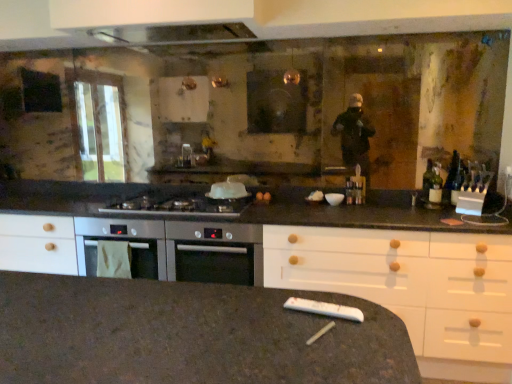
Image resolution: width=512 pixels, height=384 pixels. What do you see at coordinates (182, 206) in the screenshot? I see `satin silver cooktop at center` at bounding box center [182, 206].

This screenshot has height=384, width=512. What are the coordinates of `satin silver cooktop at center` in the screenshot? It's located at (182, 206).

I want to click on white plastic remote control at lower center, so click(x=324, y=309).

What is the approximate width of white plastic remote control at lower center?

2.12 inches.

The height and width of the screenshot is (384, 512). Describe the element at coordinates (324, 309) in the screenshot. I see `white plastic remote control at lower center` at that location.

Where is `satin silver cooktop at center`? This screenshot has height=384, width=512. satin silver cooktop at center is located at coordinates (182, 206).

Can you confirm if satin silver cooktop at center is positioned to the right of white plastic remote control at lower center?

In fact, satin silver cooktop at center is to the left of white plastic remote control at lower center.

Does satin silver cooktop at center come in front of white plastic remote control at lower center?

No, satin silver cooktop at center is further to the viewer.

Considering the points (186, 207) and (308, 301), which point is behind, point (186, 207) or point (308, 301)?

The point (186, 207) is farther.

From the image's perspective, is satin silver cooktop at center on white plastic remote control at lower center?

Indeed, from the image's perspective, satin silver cooktop at center is shown above white plastic remote control at lower center.

From a real-world perspective, between satin silver cooktop at center and white plastic remote control at lower center, who is vertically higher?

satin silver cooktop at center.

Which of these two, satin silver cooktop at center or white plastic remote control at lower center, is wider?

Wider between the two is satin silver cooktop at center.

Considering the sizes of objects satin silver cooktop at center and white plastic remote control at lower center in the image provided, who is taller, satin silver cooktop at center or white plastic remote control at lower center?

Standing taller between the two is satin silver cooktop at center.

Considering the sizes of objects satin silver cooktop at center and white plastic remote control at lower center in the image provided, who is smaller, satin silver cooktop at center or white plastic remote control at lower center?

Smaller between the two is white plastic remote control at lower center.

Looking at this image, would you say satin silver cooktop at center is outside white plastic remote control at lower center?

satin silver cooktop at center lies outside white plastic remote control at lower center's area.

Would you consider satin silver cooktop at center to be distant from white plastic remote control at lower center?

Indeed, satin silver cooktop at center is not near white plastic remote control at lower center.

Is satin silver cooktop at center oriented away from white plastic remote control at lower center?

satin silver cooktop at center does not have its back to white plastic remote control at lower center.

What's the angular difference between satin silver cooktop at center and white plastic remote control at lower center's facing directions?

There is a 11.6-degree angle between the facing directions of satin silver cooktop at center and white plastic remote control at lower center.

Where is `appliance that appears in front of the satin silver cooktop at center`? appliance that appears in front of the satin silver cooktop at center is located at coordinates (324, 309).

From the picture: Between white plastic remote control at lower center and satin silver cooktop at center, which one appears on the right side from the viewer's perspective?

From the viewer's perspective, white plastic remote control at lower center appears more on the right side.

Which is behind, white plastic remote control at lower center or satin silver cooktop at center?

Positioned behind is satin silver cooktop at center.

Considering the points (346, 311) and (206, 194), which point is in front, point (346, 311) or point (206, 194)?

Point (346, 311)

From the image's perspective, which one is positioned lower, white plastic remote control at lower center or satin silver cooktop at center?

white plastic remote control at lower center, from the image's perspective.

From a real-world perspective, who is located higher, white plastic remote control at lower center or satin silver cooktop at center?

satin silver cooktop at center, from a real-world perspective.

Looking at their sizes, would you say white plastic remote control at lower center is wider or thinner than satin silver cooktop at center?

white plastic remote control at lower center is thinner than satin silver cooktop at center.

Considering the sizes of objects white plastic remote control at lower center and satin silver cooktop at center in the image provided, who is taller, white plastic remote control at lower center or satin silver cooktop at center?

With more height is satin silver cooktop at center.

Based on their sizes in the image, would you say white plastic remote control at lower center is bigger or smaller than satin silver cooktop at center?

In the image, white plastic remote control at lower center appears to be smaller than satin silver cooktop at center.

Choose the correct answer: Is white plastic remote control at lower center inside satin silver cooktop at center or outside it?

The correct answer is: outside.

Does white plastic remote control at lower center touch satin silver cooktop at center?

No, white plastic remote control at lower center is not next to satin silver cooktop at center.

Is satin silver cooktop at center at the back of white plastic remote control at lower center?

white plastic remote control at lower center does not have its back to satin silver cooktop at center.

Can you tell me how much white plastic remote control at lower center and satin silver cooktop at center differ in facing direction?

The angle between the facing direction of white plastic remote control at lower center and the facing direction of satin silver cooktop at center is 11.6 degrees.

Find the location of `appliance in front of the satin silver cooktop at center`. appliance in front of the satin silver cooktop at center is located at coordinates (324, 309).

In the image, there is a satin silver cooktop at center. Find the location of `appliance below it (from the image's perspective)`. appliance below it (from the image's perspective) is located at coordinates (324, 309).

Identify the location of gas stove on the left of white plastic remote control at lower center. The height and width of the screenshot is (384, 512). (182, 206).